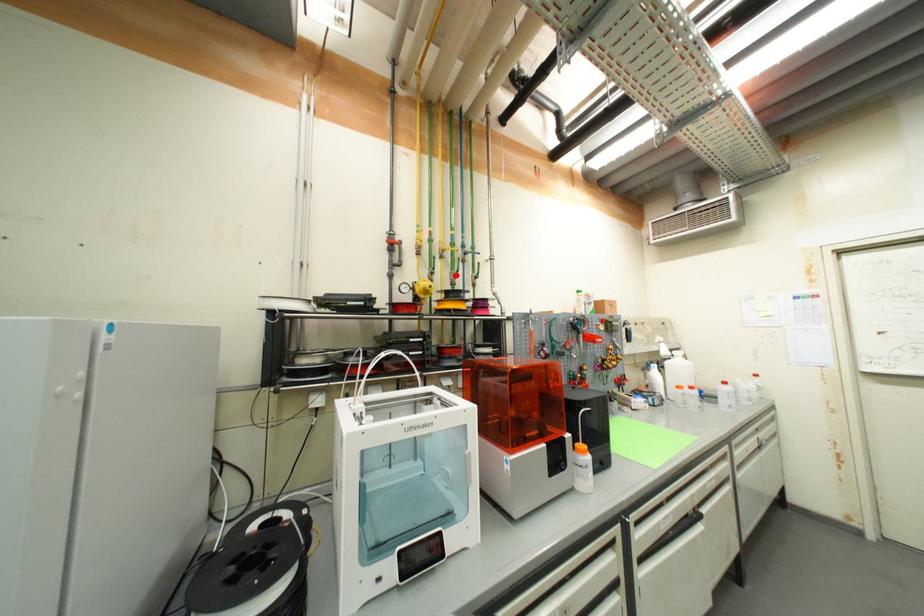
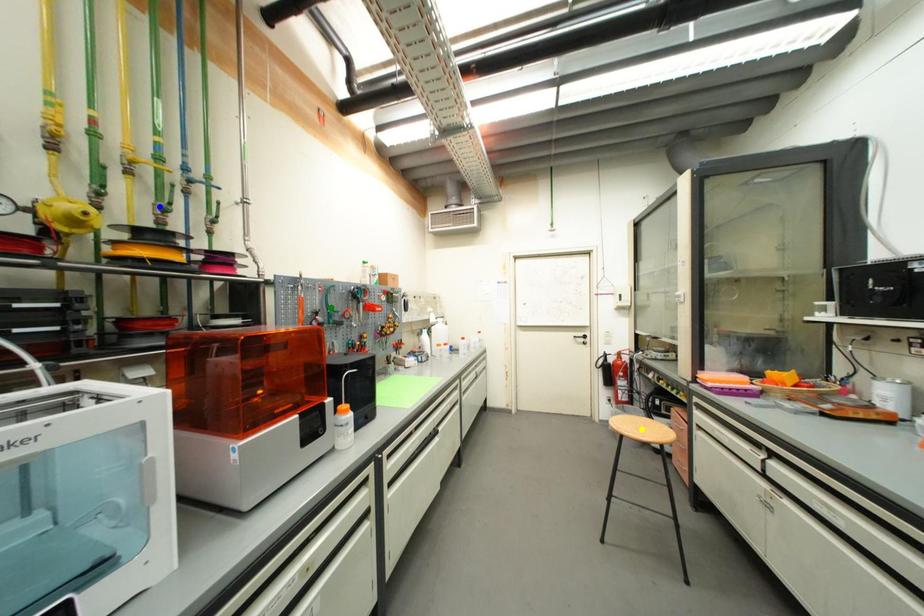
Question: I am providing you with two images of the same scene from different viewpoints. A red point is marked on the first image. You are given multiple points on the second image. In image 2, which mark is for the same physical point as the one in image 1?

Choices:
 (A) blue point
 (B) yellow point
 (C) green point

Answer: (A)